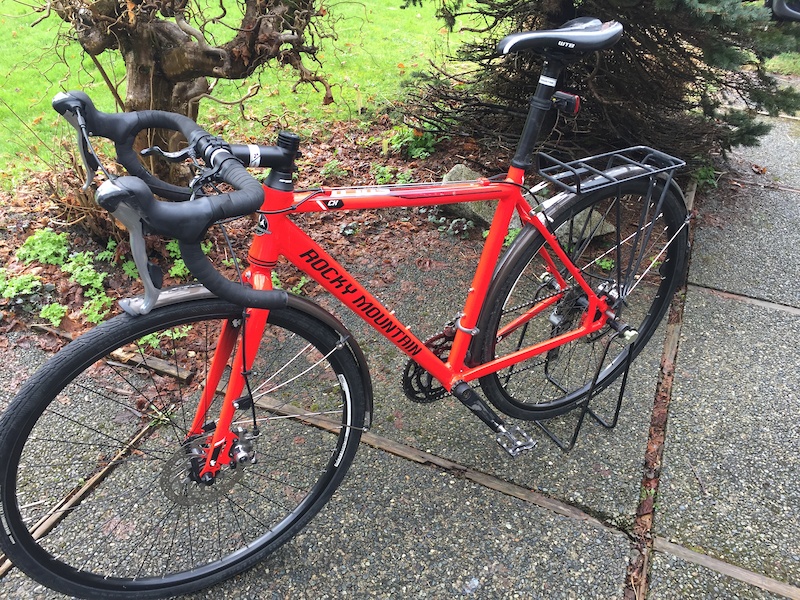
Where is `places to sit`? Image resolution: width=800 pixels, height=600 pixels. places to sit is located at coordinates (426, 560), (368, 54), (574, 35).